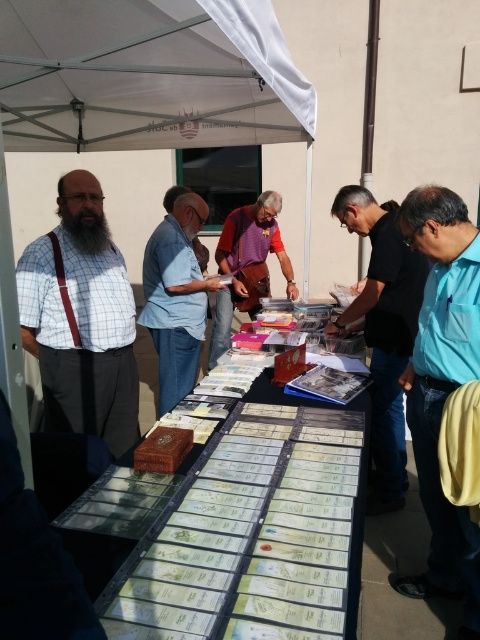
Consider the image. Does white fabric canopy at upper center appear under black fuzzy beard at left?

Actually, white fabric canopy at upper center is above black fuzzy beard at left.

Consider the image. Is white fabric canopy at upper center above black fuzzy beard at left?

Correct, white fabric canopy at upper center is located above black fuzzy beard at left.

Which is behind, point (156, 61) or point (84, 237)?

Point (156, 61)

Where is `white fabric canopy at upper center`? The width and height of the screenshot is (480, 640). white fabric canopy at upper center is located at coordinates (147, 76).

Which of these two, matte plaid shirt at left or light blue shirt at right, stands taller?

light blue shirt at right

Describe the element at coordinates (82, 320) in the screenshot. This screenshot has height=640, width=480. I see `matte plaid shirt at left` at that location.

Find the location of `matte plaid shirt at left`. matte plaid shirt at left is located at coordinates (82, 320).

Is point (128, 627) positioned behind point (68, 230)?

No.

I want to click on clear plastic table at center, so click(x=238, y=524).

What are the coordinates of `clear plastic table at center` in the screenshot? It's located at (238, 524).